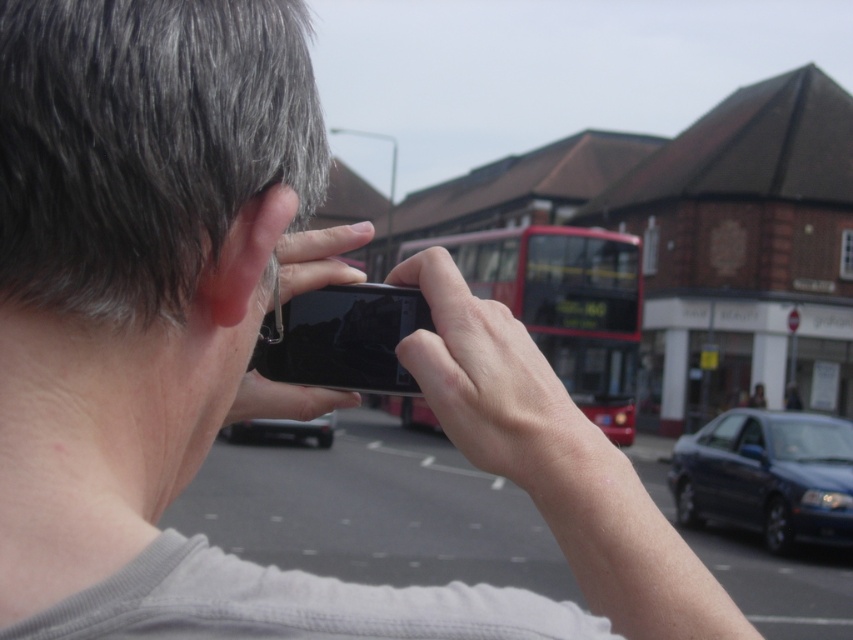
Describe the element at coordinates (341, 337) in the screenshot. I see `black glossy smartphone at center` at that location.

Can you confirm if black glossy smartphone at center is shorter than black matte phone at center?

Yes, black glossy smartphone at center is shorter than black matte phone at center.

The height and width of the screenshot is (640, 853). What are the coordinates of `black glossy smartphone at center` in the screenshot? It's located at (341, 337).

Is smooth skin hand at center bigger than black glossy smartphone at center?

Yes.

Is smooth skin hand at center smaller than black glossy smartphone at center?

No.

Find the location of a particular element. This screenshot has width=853, height=640. smooth skin hand at center is located at coordinates (491, 380).

Is shiny dark blue sedan at center-right shorter than black glossy smartphone at center?

Incorrect, shiny dark blue sedan at center-right's height does not fall short of black glossy smartphone at center's.

Who is positioned more to the right, shiny dark blue sedan at center-right or black glossy smartphone at center?

shiny dark blue sedan at center-right

Who is more forward, (x=805, y=461) or (x=405, y=312)?

Point (x=405, y=312)

The image size is (853, 640). I want to click on shiny dark blue sedan at center-right, so click(767, 476).